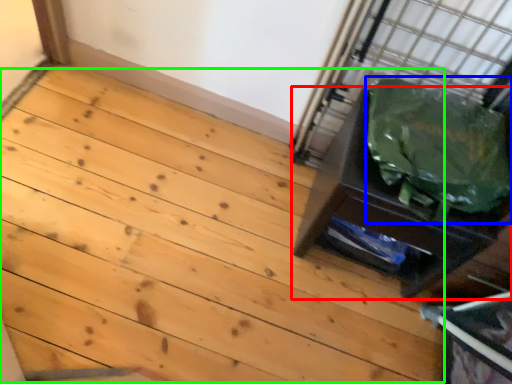
Question: Which is nearer to the furniture (highlighted by a red box)? garbage (highlighted by a blue box) or stairwell (highlighted by a green box).

Choices:
 (A) garbage
 (B) stairwell

Answer: (A)